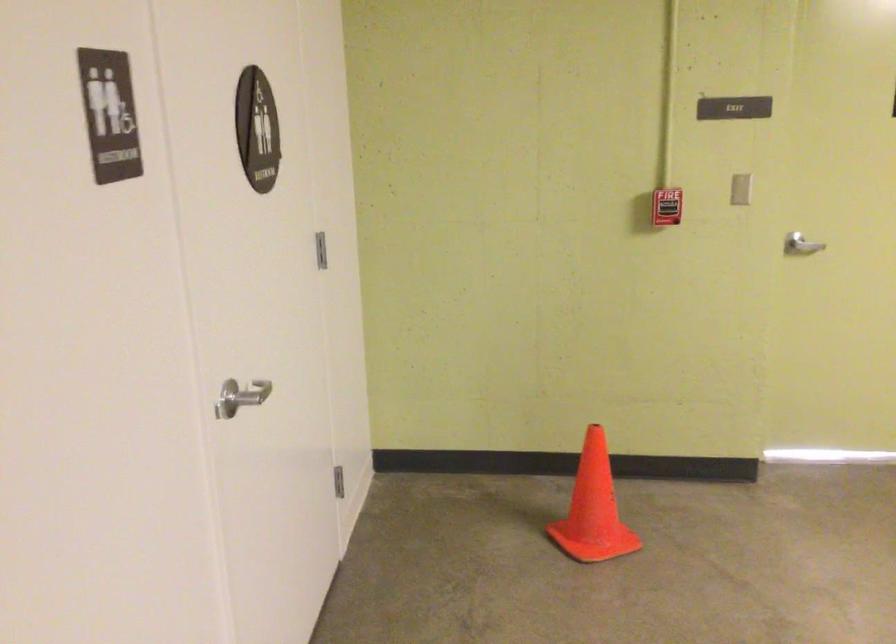
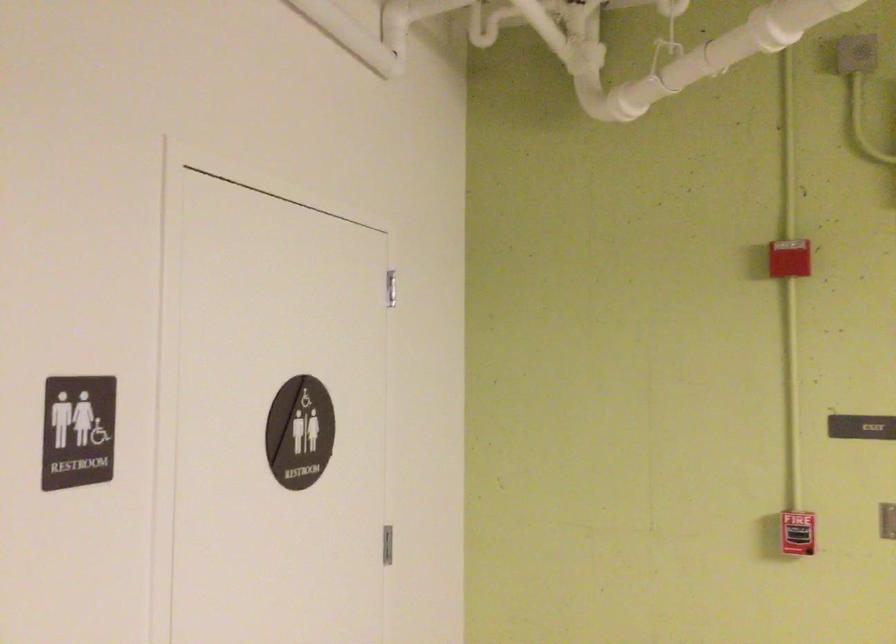
Find the pixel in the second image that matches (x=673, y=207) in the first image.

(797, 533)